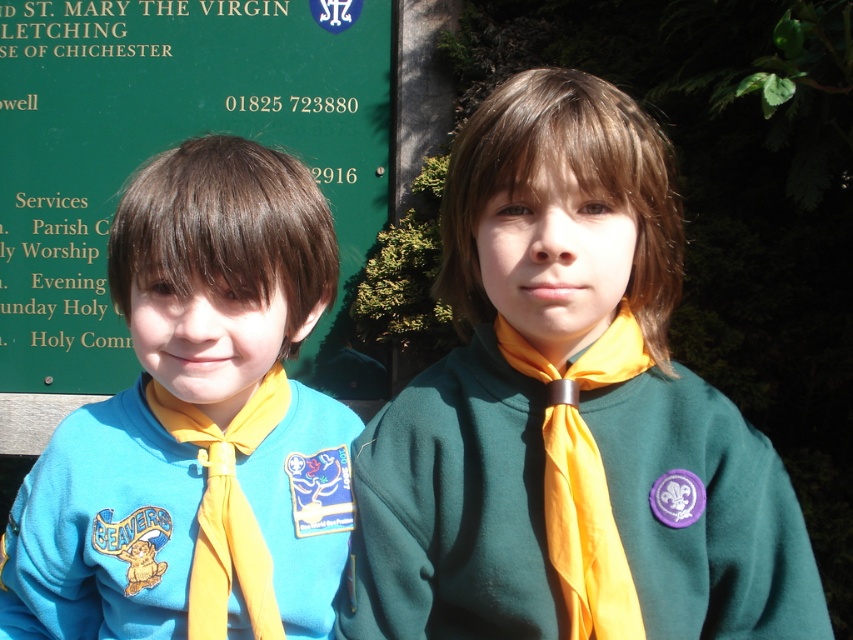
Question: Can you confirm if green fleece sweater at center is smaller than yellow satin tie at center?

Choices:
 (A) no
 (B) yes

Answer: (A)

Question: Which point is farther to the camera?

Choices:
 (A) (732, 472)
 (B) (160, 416)

Answer: (B)

Question: Does matte blue sweatshirt at left appear over green signboard at upper left?

Choices:
 (A) no
 (B) yes

Answer: (A)

Question: Which point is farther from the camera taking this photo?

Choices:
 (A) (9, 330)
 (B) (276, 172)
 (C) (235, 572)
 (D) (564, 426)

Answer: (A)

Question: Which point is closer to the camera?

Choices:
 (A) green fleece sweater at center
 (B) matte blue sweatshirt at left
 (C) green signboard at upper left
 (D) yellow satin tie at center

Answer: (A)

Question: Does green signboard at upper left appear on the left side of yellow silky necktie at center?

Choices:
 (A) no
 (B) yes

Answer: (B)